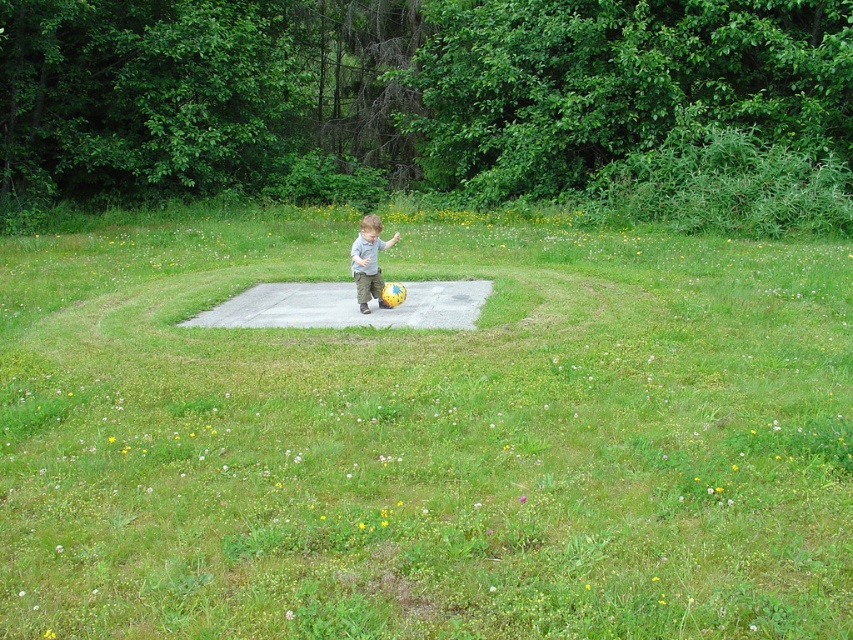
You are a photographer trying to capture the child in the scene. To get the best shot, you need to position yourself so that the concrete slab at center is visible behind the matte gray shirt at center. Based on the scene description, is this possible? Explain why or why not using the objects provided.

Yes, it is possible to position yourself so that the concrete slab at center is visible behind the matte gray shirt at center because the concrete slab at center is located to the left of the matte gray shirt at center. This spatial arrangement allows the photographer to frame the shot with the concrete slab positioned behind the child.

You are a photographer wanting to capture the matte gray shirt at center and the concrete slab at center in a single shot. Since the camera has a limited focus range, which object should you prioritize focusing on to ensure it remains sharp?

The concrete slab at center is bigger than the matte gray shirt at center, so focusing on the larger concrete slab at center would ensure it stays sharp within the camera focus range.

You are a photographer setting up a shot of the scene. You need to place a small tripod between the concrete slab at center and the matte gray shirt at center. Which object should the tripod be closer to to ensure it fits within the frame?

The concrete slab at center might be wider than matte gray shirt at center, so placing the tripod closer to the concrete slab at center would ensure it fits within the frame.